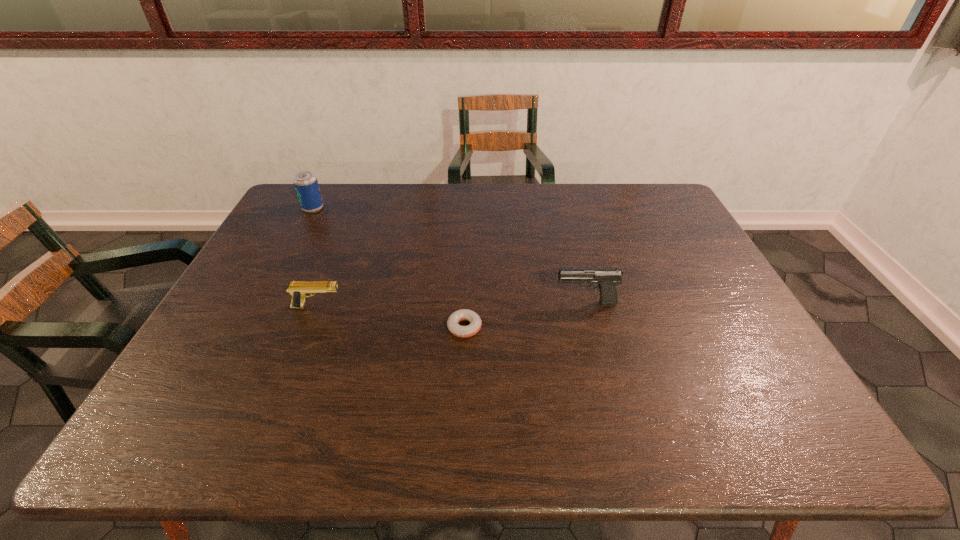
Where is `the leftmost object`? the leftmost object is located at coordinates (305, 182).

Image resolution: width=960 pixels, height=540 pixels. Find the location of `the farthest object`. the farthest object is located at coordinates (305, 182).

The image size is (960, 540). What are the coordinates of `the taller pistol` in the screenshot? It's located at (608, 278).

This screenshot has width=960, height=540. What are the coordinates of `the right pistol` in the screenshot? It's located at (608, 278).

Locate an element on the screen. This screenshot has width=960, height=540. the shorter pistol is located at coordinates (299, 290).

Locate an element on the screen. Image resolution: width=960 pixels, height=540 pixels. the left pistol is located at coordinates point(299,290).

What are the coordinates of `the nearest object` in the screenshot? It's located at (473, 328).

At what (x,y) coordinates should I click in order to perform the action: click on the second object from right to left. Please return your answer as a coordinate pair (x, y). This screenshot has height=540, width=960. Looking at the image, I should click on [473, 328].

Locate an element on the screen. vacant space situated on the right of the farthest object is located at coordinates (355, 208).

You are a GUI agent. You are given a task and a screenshot of the screen. Output one action in this format:
    pyautogui.click(x=<x>, y=<y>)
    Task: Click on the free space located aim along the barrel of the taller pistol
    
    Given the screenshot: What is the action you would take?
    pyautogui.click(x=502, y=303)